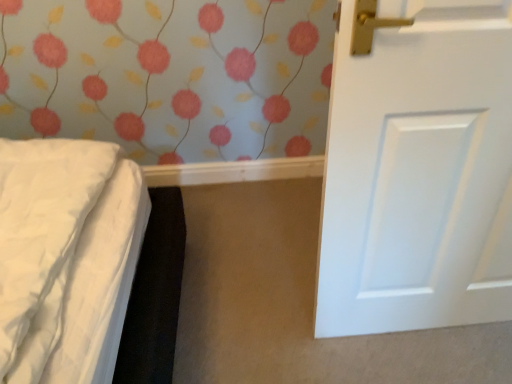
This screenshot has width=512, height=384. What do you see at coordinates (418, 171) in the screenshot?
I see `white matte door at right` at bounding box center [418, 171].

Locate an element on the screen. The height and width of the screenshot is (384, 512). white matte door at right is located at coordinates (418, 171).

The height and width of the screenshot is (384, 512). What are the coordinates of `white matte door at right` in the screenshot? It's located at (418, 171).